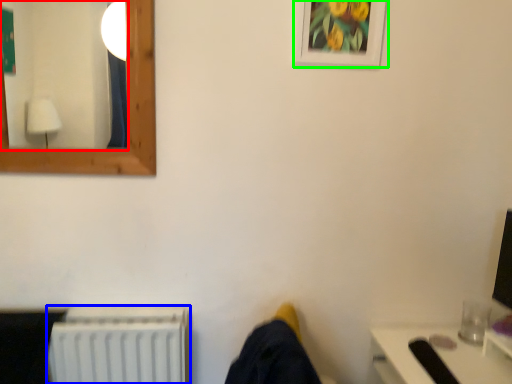
Question: Estimate the real-world distances between objects in this image. Which object is farther from mirror (highlighted by a red box), radiator (highlighted by a blue box) or picture frame (highlighted by a green box)?

Choices:
 (A) radiator
 (B) picture frame

Answer: (B)